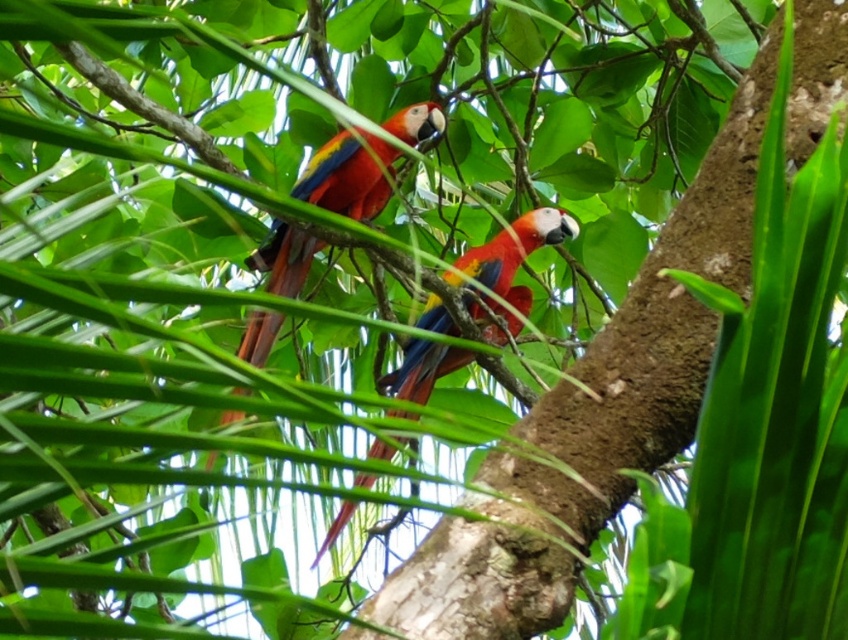
Question: Can you confirm if glossy feathers parrot at center is thinner than shiny multicolored parrot at center?

Choices:
 (A) yes
 (B) no

Answer: (A)

Question: Among these objects, which one is nearest to the camera?

Choices:
 (A) shiny multicolored parrot at center
 (B) glossy feathers parrot at center

Answer: (A)

Question: Can you confirm if glossy feathers parrot at center is wider than shiny multicolored parrot at center?

Choices:
 (A) no
 (B) yes

Answer: (A)

Question: Considering the relative positions of glossy feathers parrot at center and shiny multicolored parrot at center in the image provided, where is glossy feathers parrot at center located with respect to shiny multicolored parrot at center?

Choices:
 (A) above
 (B) below

Answer: (A)

Question: Which point is closer to the camera taking this photo?

Choices:
 (A) (400, 387)
 (B) (413, 106)

Answer: (A)